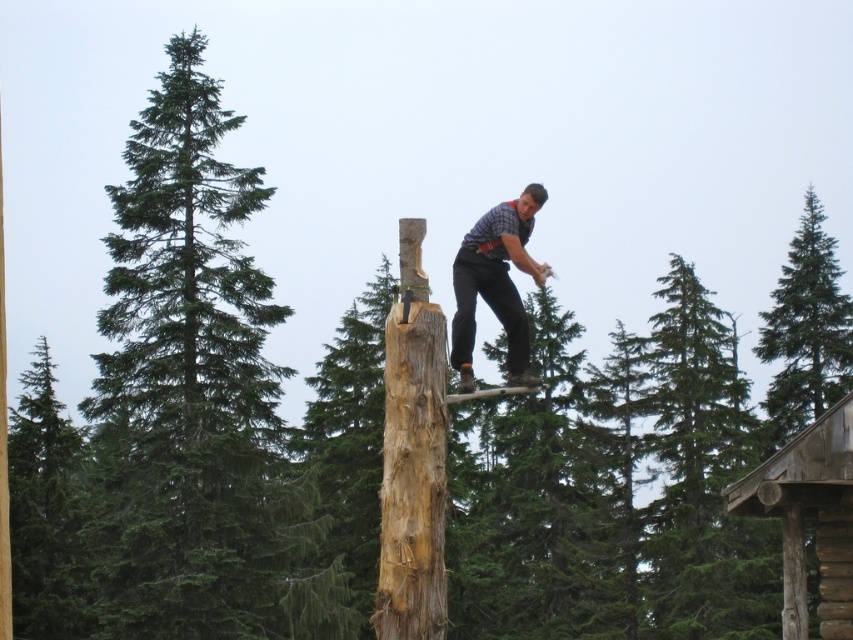
You are a photographer trying to capture the man in the matte plaid shirt at center while ensuring the green textured pine at upper right is visible in the background. Based on their relative sizes, which object appears larger in the photo?

The green textured pine at upper right appears larger in the photo because it is taller than the matte plaid shirt at center.

In the scene shown: Please look at the point at coordinates [45,509]. What object is located at that point?

The point at coordinates [45,509] is located on the green textured tree at left.